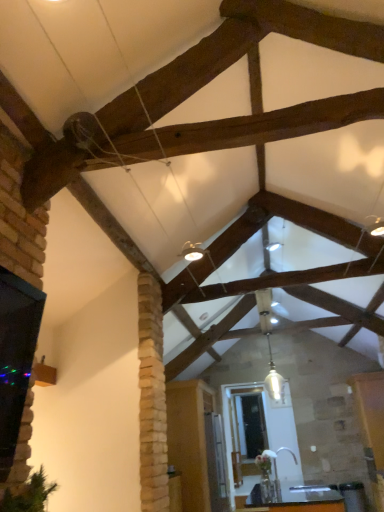
Measure the distance between point (24, 406) and camera.

A distance of 1.45 meters exists between point (24, 406) and camera.

Where is `wooden table at lower center`? The height and width of the screenshot is (512, 384). wooden table at lower center is located at coordinates (298, 501).

Measure the distance between point (276, 393) and camera.

Point (276, 393) and camera are 5.92 meters apart.

The width and height of the screenshot is (384, 512). In order to click on black glass window at left in this screenshot , I will do `click(17, 373)`.

Does wooden table at lower center have a smaller size compared to white glass pendant light at center?

No.

Does wooden table at lower center appear on the left side of white glass pendant light at center?

No.

In the scene shown: From the image's perspective, would you say wooden table at lower center is shown under white glass pendant light at center?

Correct, wooden table at lower center appears lower than white glass pendant light at center in the image.

Considering the positions of points (290, 511) and (273, 366), is point (290, 511) closer to camera compared to point (273, 366)?

Yes, it is.

In the scene shown: Is wooden table at lower center oriented away from black glass window at left?

No, wooden table at lower center is not facing away from black glass window at left.

From a real-world perspective, is wooden table at lower center physically above black glass window at left?

Actually, wooden table at lower center is physically below black glass window at left in the real world.

In terms of height, does white glass pendant light at center look taller or shorter compared to wooden table at lower center?

Clearly, white glass pendant light at center is taller compared to wooden table at lower center.

From the image's perspective, is white glass pendant light at center positioned above or below wooden table at lower center?

Based on their image positions, white glass pendant light at center is located above wooden table at lower center.

Are white glass pendant light at center and wooden table at lower center making contact?

white glass pendant light at center and wooden table at lower center are not in contact.

Is wooden table at lower center at the back of white glass pendant light at center?

No, white glass pendant light at center is not facing away from wooden table at lower center.

Is white glass pendant light at center aimed at black glass window at left?

Result: No, white glass pendant light at center is not facing towards black glass window at left.

Considering the sizes of white glass pendant light at center and black glass window at left in the image, is white glass pendant light at center taller or shorter than black glass window at left?

Considering their sizes, white glass pendant light at center has more height than black glass window at left.

Is white glass pendant light at center placed right next to black glass window at left?

No.

From the image's perspective, relative to black glass window at left, is white glass pendant light at center above or below?

white glass pendant light at center is situated lower than black glass window at left in the image.

Does black glass window at left come in front of wooden table at lower center?

Yes, black glass window at left is in front of wooden table at lower center.

From the image's perspective, would you say black glass window at left is shown under wooden table at lower center?

No, from the image's perspective, black glass window at left is not below wooden table at lower center.

Is black glass window at left looking in the opposite direction of wooden table at lower center?

No.

Which is behind, point (10, 324) or point (327, 510)?

The point (327, 510) is behind.

How different are the orientations of black glass window at left and white glass pendant light at center in degrees?

86.9 degrees.

Looking at this image, which object is wider, black glass window at left or white glass pendant light at center?

black glass window at left is wider.

In terms of height, does black glass window at left look taller or shorter compared to white glass pendant light at center?

black glass window at left is shorter than white glass pendant light at center.

You are a GUI agent. You are given a task and a screenshot of the screen. Output one action in this format:
    pyautogui.click(x=<x>, y=<y>)
    Task: Click on the light fixture positioned vertically above the wooden table at lower center (from a real-world perspective)
    
    Given the screenshot: What is the action you would take?
    pyautogui.click(x=274, y=379)

Image resolution: width=384 pixels, height=512 pixels. I want to click on window in front of the wooden table at lower center, so click(17, 373).

Looking at the image, which one is located closer to white glass pendant light at center, black glass window at left or wooden table at lower center?

Among the two, wooden table at lower center is located nearer to white glass pendant light at center.

Looking at the image, which one is located further to white glass pendant light at center, wooden table at lower center or black glass window at left?

black glass window at left is positioned further to the anchor white glass pendant light at center.

Considering their positions, is white glass pendant light at center positioned further to black glass window at left than wooden table at lower center?

Among the two, wooden table at lower center is located further to black glass window at left.

Estimate the real-world distances between objects in this image. Which object is closer to wooden table at lower center, black glass window at left or white glass pendant light at center?

white glass pendant light at center is positioned closer to the anchor wooden table at lower center.

Based on their spatial positions, is wooden table at lower center or white glass pendant light at center further from black glass window at left?

wooden table at lower center lies further to black glass window at left than the other object.

Which object lies further to the anchor point wooden table at lower center, white glass pendant light at center or black glass window at left?

The object further to wooden table at lower center is black glass window at left.

Find the location of a particular element. table positioned between black glass window at left and white glass pendant light at center from near to far is located at coordinates (298, 501).